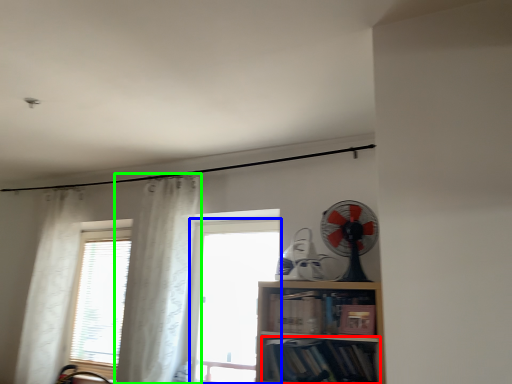
Question: Which is farther away from book (highlighted by a red box)? window (highlighted by a blue box) or curtain (highlighted by a green box)?

Choices:
 (A) window
 (B) curtain

Answer: (A)